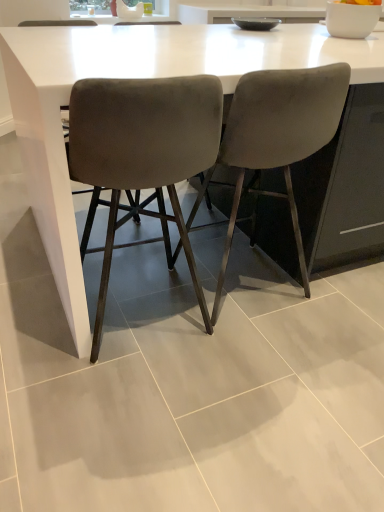
Question: From a real-world perspective, is white glossy table at center physically located above or below velvet grey chair at center, the second chair in the right-to-left sequence?

Choices:
 (A) above
 (B) below

Answer: (B)

Question: Relative to velvet grey chair at center, the second chair in the right-to-left sequence, is white glossy table at center in front or behind?

Choices:
 (A) front
 (B) behind

Answer: (B)

Question: Which object is the farthest from the white glossy table at center?

Choices:
 (A) velvet grey chair at center, which appears as the 1th chair when viewed from the left
 (B) velvet grey chair at center, the second chair when ordered from left to right

Answer: (B)

Question: Estimate the real-world distances between objects in this image. Which object is farther from the velvet grey chair at center, which appears as the 1th chair when viewed from the left?

Choices:
 (A) white glossy table at center
 (B) velvet grey chair at center, placed as the first chair when sorted from right to left

Answer: (A)